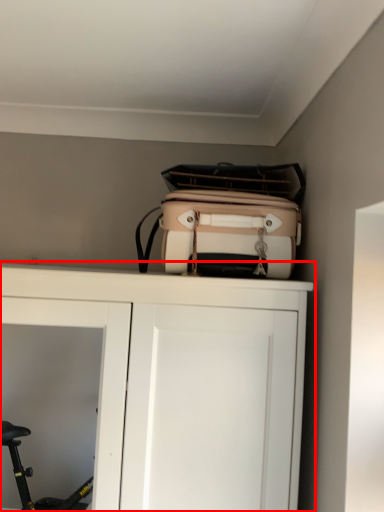
Question: From the image's perspective, considering the relative positions of cupboard (annotated by the red box) and luggage and bags in the image provided, where is cupboard (annotated by the red box) located with respect to the staircase?

Choices:
 (A) above
 (B) below

Answer: (B)